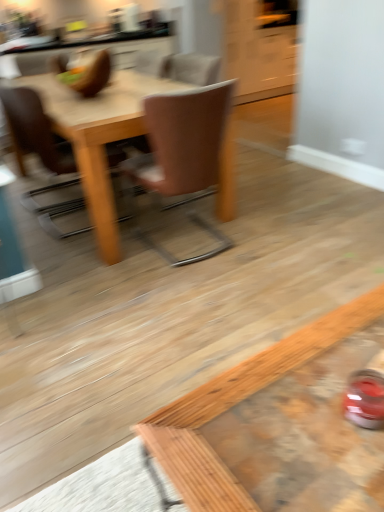
Question: From the image's perspective, is wooden coffee table at lower right under brown leather chair at upper left, the first chair in the left-to-right sequence?

Choices:
 (A) yes
 (B) no

Answer: (A)

Question: Is wooden coffee table at lower right far from brown leather chair at upper left, acting as the second chair starting from the right?

Choices:
 (A) yes
 (B) no

Answer: (A)

Question: Does wooden coffee table at lower right have a greater height compared to brown leather chair at upper left, acting as the second chair starting from the right?

Choices:
 (A) no
 (B) yes

Answer: (A)

Question: Is wooden coffee table at lower right turned away from brown leather chair at upper left, the first chair in the left-to-right sequence?

Choices:
 (A) no
 (B) yes

Answer: (A)

Question: Does wooden coffee table at lower right lie in front of brown leather chair at upper left, acting as the second chair starting from the right?

Choices:
 (A) yes
 (B) no

Answer: (A)

Question: Would you say wooden coffee table at lower right is to the left or to the right of brown leather chair at center, which is the 2th chair from left to right, in the picture?

Choices:
 (A) left
 (B) right

Answer: (B)

Question: From a real-world perspective, is wooden coffee table at lower right positioned above or below brown leather chair at center, which is the first chair from right to left?

Choices:
 (A) above
 (B) below

Answer: (B)

Question: Looking at the image, does wooden coffee table at lower right seem bigger or smaller compared to brown leather chair at center, which is the 2th chair from left to right?

Choices:
 (A) small
 (B) big

Answer: (A)

Question: From their relative heights in the image, would you say wooden coffee table at lower right is taller or shorter than brown leather chair at center, which is the 2th chair from left to right?

Choices:
 (A) short
 (B) tall

Answer: (A)

Question: Is light brown wooden table at center bigger or smaller than brown leather chair at upper left, the first chair in the left-to-right sequence?

Choices:
 (A) small
 (B) big

Answer: (B)

Question: From the image's perspective, is light brown wooden table at center positioned above or below brown leather chair at upper left, acting as the second chair starting from the right?

Choices:
 (A) below
 (B) above

Answer: (B)

Question: Is point (92, 190) positioned closer to the camera than point (44, 216)?

Choices:
 (A) farther
 (B) closer

Answer: (B)

Question: Is light brown wooden table at center in front of or behind brown leather chair at upper left, the first chair in the left-to-right sequence, in the image?

Choices:
 (A) behind
 (B) front

Answer: (B)

Question: Does point (46, 227) appear closer or farther from the camera than point (244, 395)?

Choices:
 (A) farther
 (B) closer

Answer: (A)

Question: Would you say brown leather chair at upper left, acting as the second chair starting from the right, is to the left or to the right of wooden coffee table at lower right in the picture?

Choices:
 (A) left
 (B) right

Answer: (A)